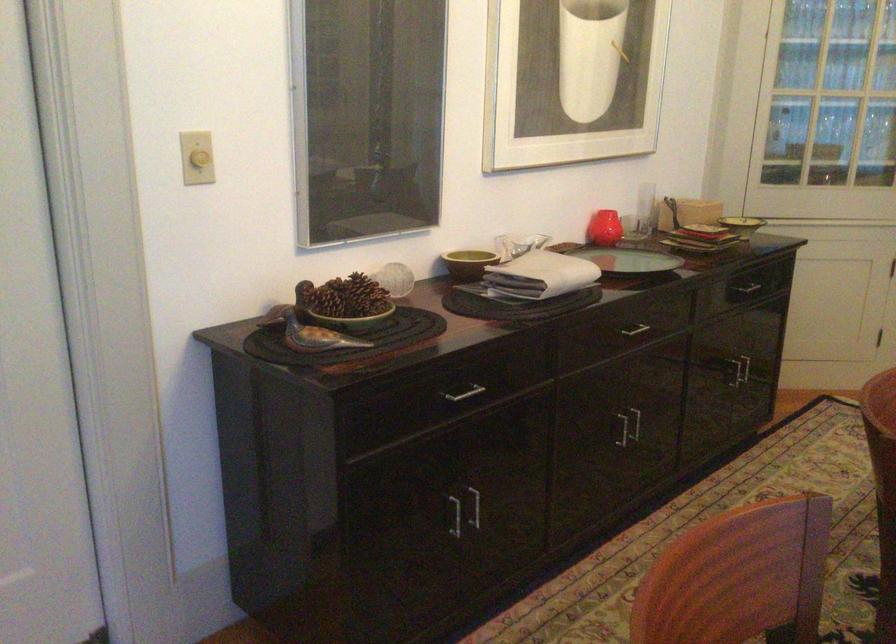
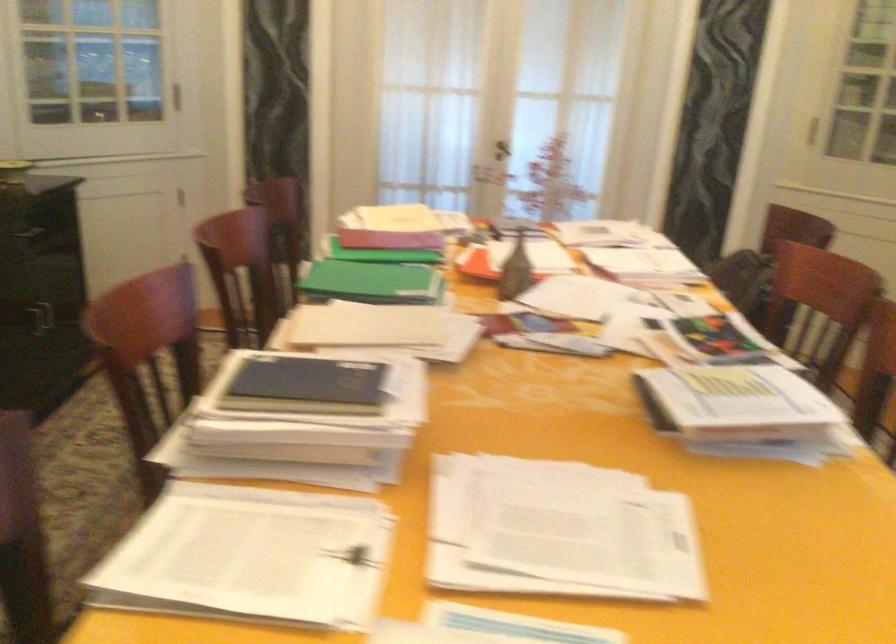
Question: The first image is from the beginning of the video and the second image is from the end. How did the camera likely rotate when shooting the video?

Choices:
 (A) Left
 (B) Right
 (C) Up
 (D) Down

Answer: (B)